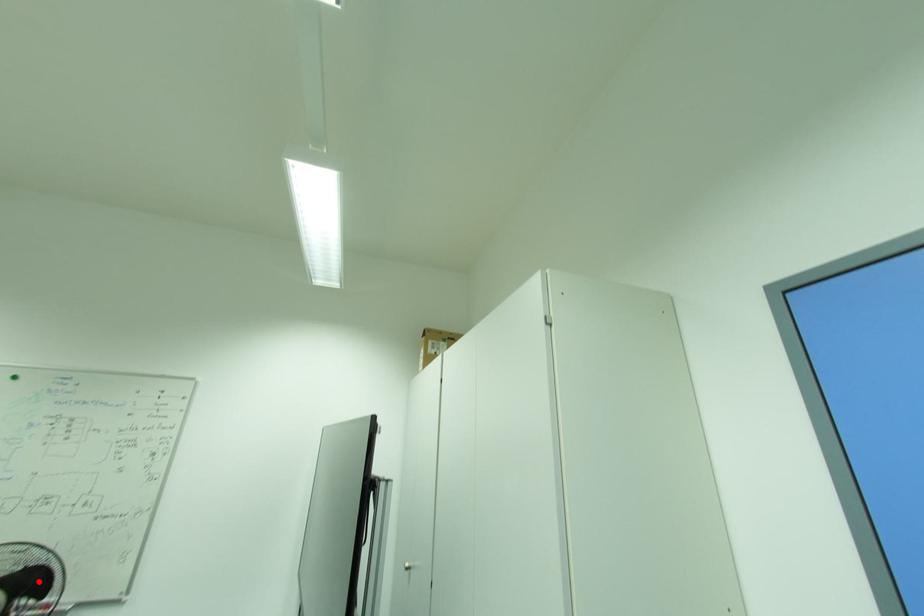
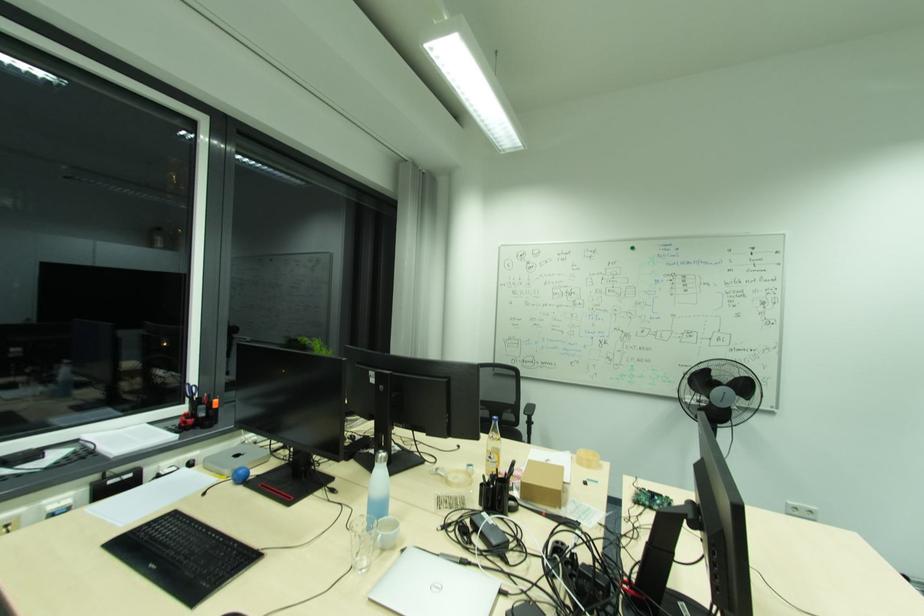
Question: I am providing you with two images of the same scene from different viewpoints. Image1 has a red point marked. In image2, the corresponding 3D location appears at what relative position? Reply with the corresponding letter.

Choices:
 (A) Closer
 (B) Farther

Answer: (B)